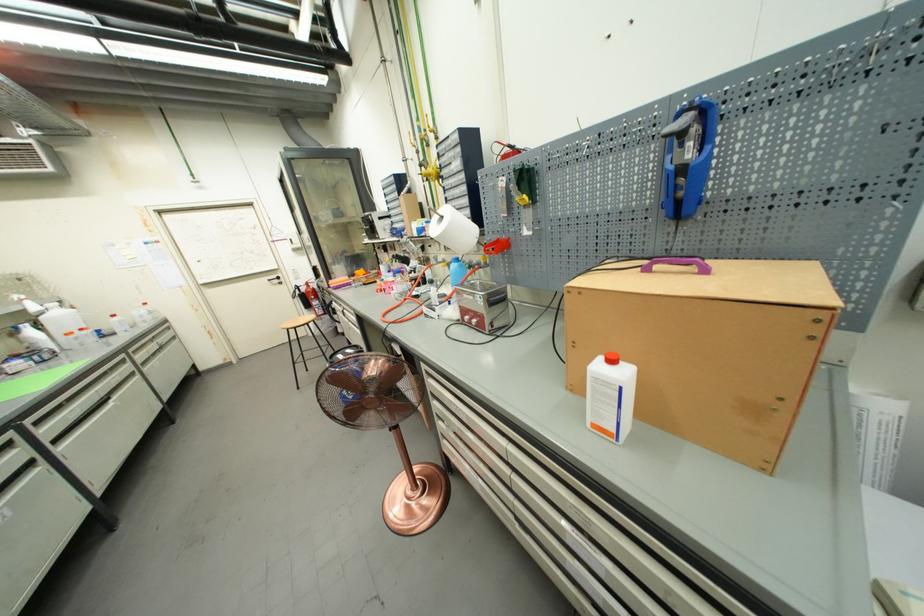
The height and width of the screenshot is (616, 924). What do you see at coordinates (298, 322) in the screenshot?
I see `the stool sitting surface` at bounding box center [298, 322].